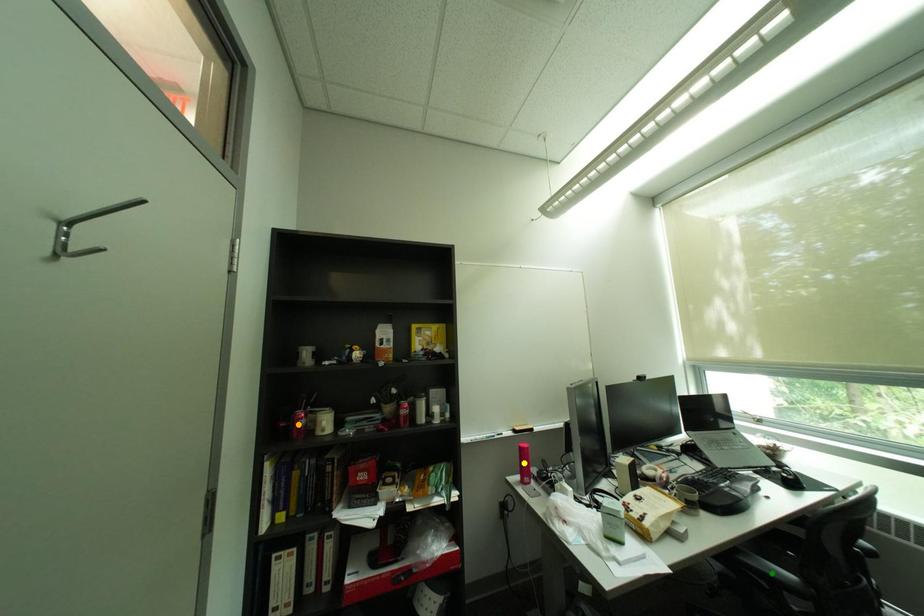
Order these from nearest to farthest:
1. green point
2. orange point
3. yellow point

green point → orange point → yellow point